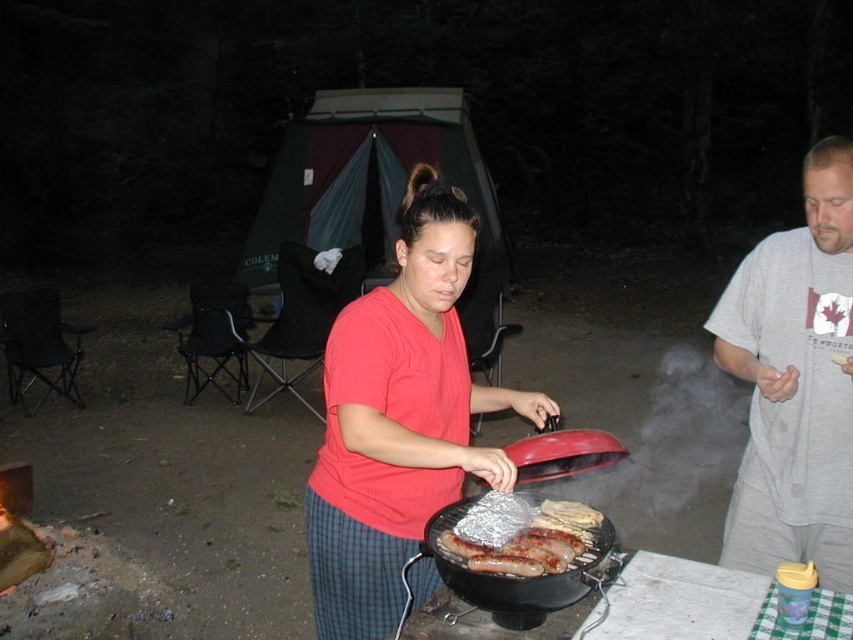
Looking at this image, is red matte shirt at center thinner than gray cotton t-shirt at right?

No, red matte shirt at center is not thinner than gray cotton t-shirt at right.

You are a GUI agent. You are given a task and a screenshot of the screen. Output one action in this format:
    pyautogui.click(x=<x>, y=<y>)
    Task: Click on the red matte shirt at center
    The height and width of the screenshot is (640, 853).
    Given the screenshot: What is the action you would take?
    pyautogui.click(x=399, y=419)

Find the location of a particular element. red matte shirt at center is located at coordinates (399, 419).

Does gray cotton t-shirt at right come behind grilled sausage at center?

Yes, gray cotton t-shirt at right is behind grilled sausage at center.

Which is more to the right, gray cotton t-shirt at right or grilled sausage at center?

From the viewer's perspective, gray cotton t-shirt at right appears more on the right side.

Is point (821, 308) behind point (480, 508)?

Yes, point (821, 308) is behind point (480, 508).

Image resolution: width=853 pixels, height=640 pixels. Identify the location of gray cotton t-shirt at right. (795, 381).

Who is taller, red matte shirt at center or matte red grill at center?

red matte shirt at center

Is point (339, 592) closer to viewer compared to point (793, 531)?

That is True.

You are a GUI agent. You are given a task and a screenshot of the screen. Output one action in this format:
    pyautogui.click(x=<x>, y=<y>)
    Task: Click on the red matte shirt at center
    This screenshot has height=640, width=853.
    Given the screenshot: What is the action you would take?
    pyautogui.click(x=399, y=419)